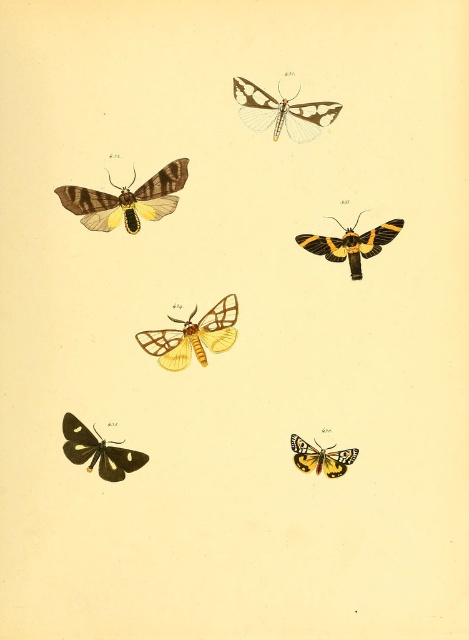
In the scene shown: You are an entomologist studying moth sizes in this image. Which of the two insects, the translucent white and black moth at upper center or the black glossy butterfly at lower left, has a greater wingspan?

The translucent white and black moth at upper center has a greater wingspan than the black glossy butterfly at lower left because its width surpasses the butterfly.

You are standing in front of the image of six moths arranged in two rows. There are two points labeled in the image, point (127,202) and point (352,232). Which point is closer to you?

Point (127,202) is closer to you because it is in front of point (352,232).